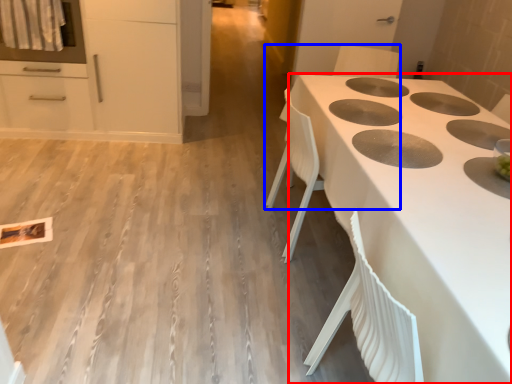
Question: Which object is closer to the camera taking this photo, countertop (highlighted by a red box) or chair (highlighted by a blue box)?

Choices:
 (A) countertop
 (B) chair

Answer: (A)